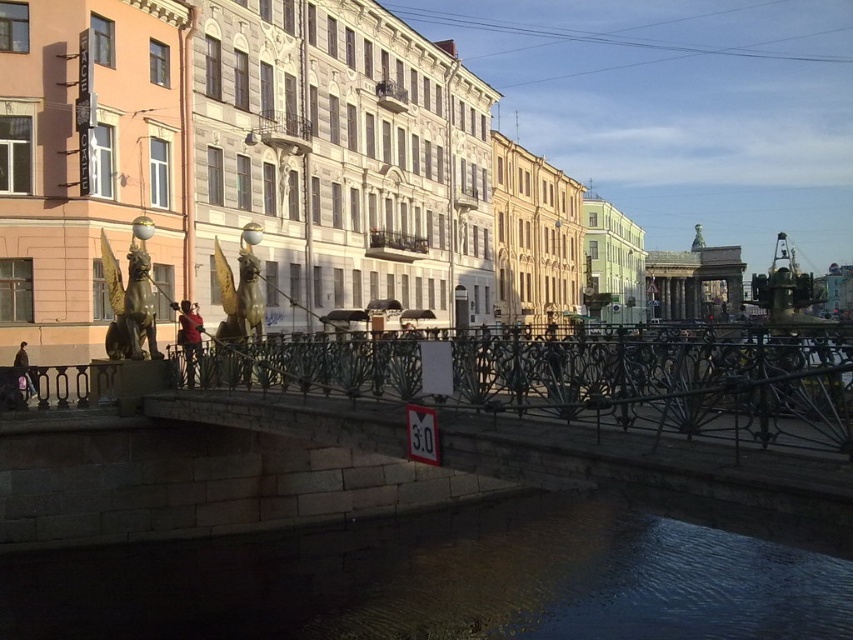
Question: Which object appears closest to the camera in this image?

Choices:
 (A) black wrought iron fence at center
 (B) dark stone water at lower center

Answer: (B)

Question: From the image, what is the correct spatial relationship of dark stone water at lower center in relation to black wrought iron fence at center?

Choices:
 (A) below
 (B) above

Answer: (A)

Question: Among these points, which one is nearest to the camera?

Choices:
 (A) coord(544,605)
 (B) coord(212,346)

Answer: (A)

Question: Which point appears farthest from the camera in this image?

Choices:
 (A) (556, 365)
 (B) (389, 532)

Answer: (B)

Question: Can you confirm if dark stone water at lower center is positioned to the left of black wrought iron fence at center?

Choices:
 (A) yes
 (B) no

Answer: (A)

Question: Is dark stone water at lower center thinner than black wrought iron fence at center?

Choices:
 (A) no
 (B) yes

Answer: (A)